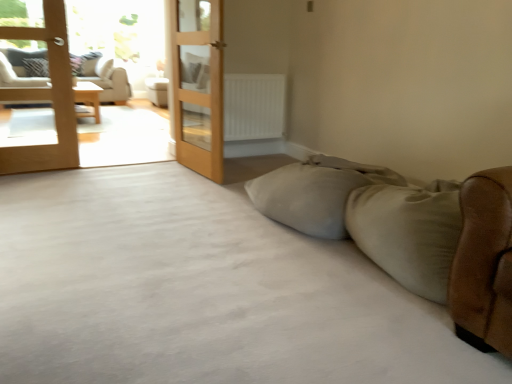
Question: Is wooden table at left outside of white matte radiator at center?

Choices:
 (A) yes
 (B) no

Answer: (A)

Question: Considering the relative positions of wooden table at left and white matte radiator at center in the image provided, is wooden table at left to the right of white matte radiator at center from the viewer's perspective?

Choices:
 (A) yes
 (B) no

Answer: (B)

Question: Does wooden table at left touch white matte radiator at center?

Choices:
 (A) no
 (B) yes

Answer: (A)

Question: Can you confirm if wooden table at left is wider than white matte radiator at center?

Choices:
 (A) yes
 (B) no

Answer: (A)

Question: Is wooden table at left oriented towards white matte radiator at center?

Choices:
 (A) yes
 (B) no

Answer: (B)

Question: Relative to brown leather studio couch at right, placed as the 2th studio couch when sorted from left to right, is white matte radiator at center in front or behind?

Choices:
 (A) front
 (B) behind

Answer: (B)

Question: Choose the correct answer: Is white matte radiator at center inside brown leather studio couch at right, placed as the 2th studio couch when sorted from left to right, or outside it?

Choices:
 (A) outside
 (B) inside

Answer: (A)

Question: In terms of size, does white matte radiator at center appear bigger or smaller than brown leather studio couch at right, the 1th studio couch viewed from the front?

Choices:
 (A) small
 (B) big

Answer: (A)

Question: Considering the positions of white matte radiator at center and brown leather studio couch at right, the 1th studio couch viewed from the front, in the image, is white matte radiator at center wider or thinner than brown leather studio couch at right, the 1th studio couch viewed from the front,?

Choices:
 (A) thin
 (B) wide

Answer: (A)

Question: Is point (50, 4) positioned closer to the camera than point (225, 135)?

Choices:
 (A) farther
 (B) closer

Answer: (B)

Question: Do you think light brown wooden terrace at left is within white matte radiator at center, or outside of it?

Choices:
 (A) outside
 (B) inside

Answer: (A)

Question: Looking at the image, does light brown wooden terrace at left seem bigger or smaller compared to white matte radiator at center?

Choices:
 (A) big
 (B) small

Answer: (A)

Question: From the image's perspective, is light brown wooden terrace at left located above or below white matte radiator at center?

Choices:
 (A) above
 (B) below

Answer: (A)

Question: Relative to matte white couch at left, which is the first studio couch in top-to-bottom order, is white matte radiator at center in front or behind?

Choices:
 (A) behind
 (B) front

Answer: (B)

Question: From a real-world perspective, relative to matte white couch at left, the 1th studio couch positioned from the left, is white matte radiator at center vertically above or below?

Choices:
 (A) above
 (B) below

Answer: (B)